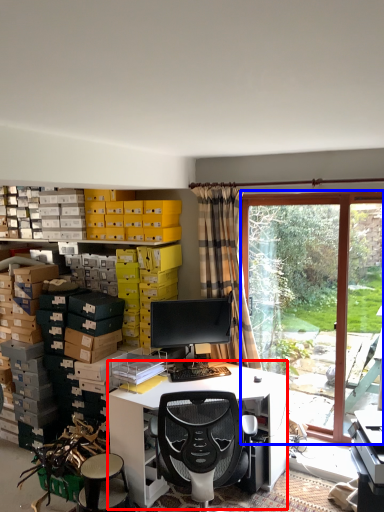
Question: Which of the following is the closest to the observer, desk (highlighted by a red box) or bay window (highlighted by a blue box)?

Choices:
 (A) desk
 (B) bay window

Answer: (A)